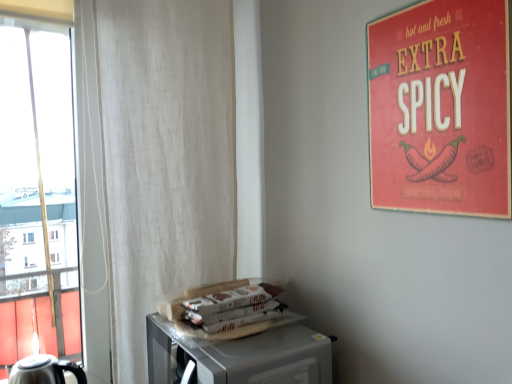
Question: From the image's perspective, relative to metallic microwave at lower right, is stainless steel kettle at lower left above or below?

Choices:
 (A) below
 (B) above

Answer: (A)

Question: Is point (51, 360) closer or farther from the camera than point (200, 344)?

Choices:
 (A) farther
 (B) closer

Answer: (A)

Question: Which is nearer to the metallic microwave at lower right?

Choices:
 (A) white fabric curtain at left
 (B) red matte poster at upper right
 (C) white paper magazine at lower center
 (D) stainless steel kettle at lower left

Answer: (C)

Question: Which of these objects is positioned closest to the red matte poster at upper right?

Choices:
 (A) metallic microwave at lower right
 (B) white fabric curtain at left
 (C) white paper magazine at lower center
 (D) stainless steel kettle at lower left

Answer: (A)